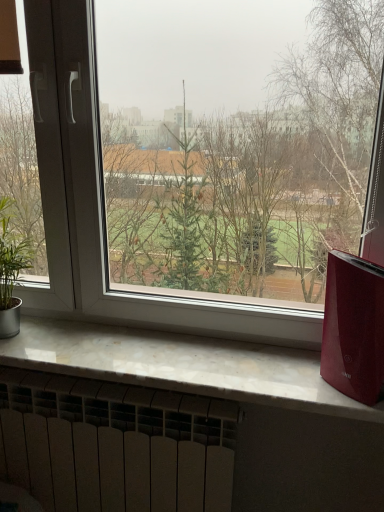
Question: Is white matte radiator at bottom facing towards green leafy plant at left?

Choices:
 (A) yes
 (B) no

Answer: (B)

Question: Is the position of white matte radiator at bottom more distant than that of green leafy plant at left?

Choices:
 (A) no
 (B) yes

Answer: (B)

Question: Does white matte radiator at bottom have a smaller size compared to green leafy plant at left?

Choices:
 (A) yes
 (B) no

Answer: (B)

Question: Does white matte radiator at bottom have a larger size compared to green leafy plant at left?

Choices:
 (A) yes
 (B) no

Answer: (A)

Question: From a real-world perspective, is white matte radiator at bottom located higher than green leafy plant at left?

Choices:
 (A) no
 (B) yes

Answer: (A)

Question: From the image's perspective, is white matte radiator at bottom on top of green leafy plant at left?

Choices:
 (A) yes
 (B) no

Answer: (B)

Question: Is the position of white marble window sill at lower center less distant than that of green leafy plant at left?

Choices:
 (A) yes
 (B) no

Answer: (A)

Question: Does white marble window sill at lower center have a larger size compared to green leafy plant at left?

Choices:
 (A) no
 (B) yes

Answer: (B)

Question: Does white marble window sill at lower center have a lesser height compared to green leafy plant at left?

Choices:
 (A) no
 (B) yes

Answer: (B)

Question: Is white marble window sill at lower center oriented away from green leafy plant at left?

Choices:
 (A) no
 (B) yes

Answer: (A)

Question: Is white marble window sill at lower center taller than green leafy plant at left?

Choices:
 (A) no
 (B) yes

Answer: (A)

Question: Does white marble window sill at lower center have a lesser width compared to green leafy plant at left?

Choices:
 (A) yes
 (B) no

Answer: (B)

Question: Is green leafy plant at left positioned with its back to shiny red air purifier at right?

Choices:
 (A) no
 (B) yes

Answer: (A)